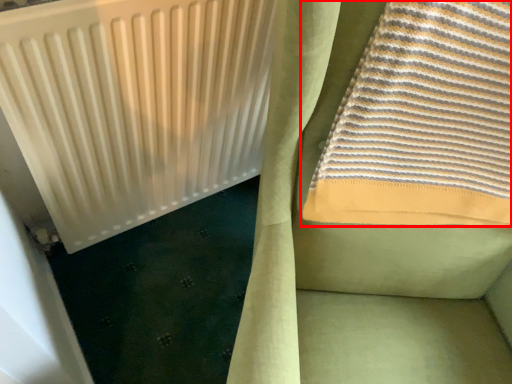
Question: From the image's perspective, where is towel (annotated by the red box) located in relation to radiator in the image?

Choices:
 (A) above
 (B) below

Answer: (A)